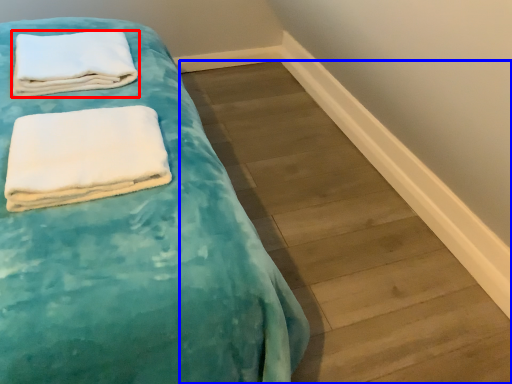
Question: Which point is closer to the camera, towel (highlighted by a red box) or plank (highlighted by a blue box)?

Choices:
 (A) towel
 (B) plank

Answer: (B)